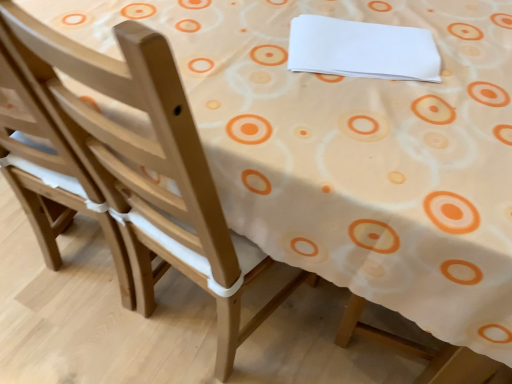
Question: Does light wood chair at left have a larger size compared to white paper at upper center?

Choices:
 (A) no
 (B) yes

Answer: (B)

Question: Is light wood chair at left directly adjacent to white paper at upper center?

Choices:
 (A) yes
 (B) no

Answer: (B)

Question: From the image's perspective, does light wood chair at left appear higher than white paper at upper center?

Choices:
 (A) no
 (B) yes

Answer: (A)

Question: Would you say white paper at upper center is part of light wood chair at left's contents?

Choices:
 (A) no
 (B) yes

Answer: (A)

Question: Is the depth of light wood chair at left less than that of white paper at upper center?

Choices:
 (A) no
 (B) yes

Answer: (B)

Question: From a real-world perspective, does light wood chair at left stand above white paper at upper center?

Choices:
 (A) yes
 (B) no

Answer: (B)

Question: From a real-world perspective, does white paper at upper center stand above light wood chair at left?

Choices:
 (A) yes
 (B) no

Answer: (A)

Question: Does white paper at upper center appear on the left side of light wood chair at left?

Choices:
 (A) no
 (B) yes

Answer: (A)

Question: Can light wood chair at left be found inside white paper at upper center?

Choices:
 (A) yes
 (B) no

Answer: (B)

Question: Is white paper at upper center smaller than light wood chair at left?

Choices:
 (A) no
 (B) yes

Answer: (B)

Question: Does white paper at upper center turn towards light wood chair at left?

Choices:
 (A) yes
 (B) no

Answer: (A)

Question: Can you confirm if white paper at upper center is shorter than light wood chair at left?

Choices:
 (A) no
 (B) yes

Answer: (B)

Question: From a real-world perspective, relative to white paper at upper center, is light wood chair at left vertically above or below?

Choices:
 (A) above
 (B) below

Answer: (B)